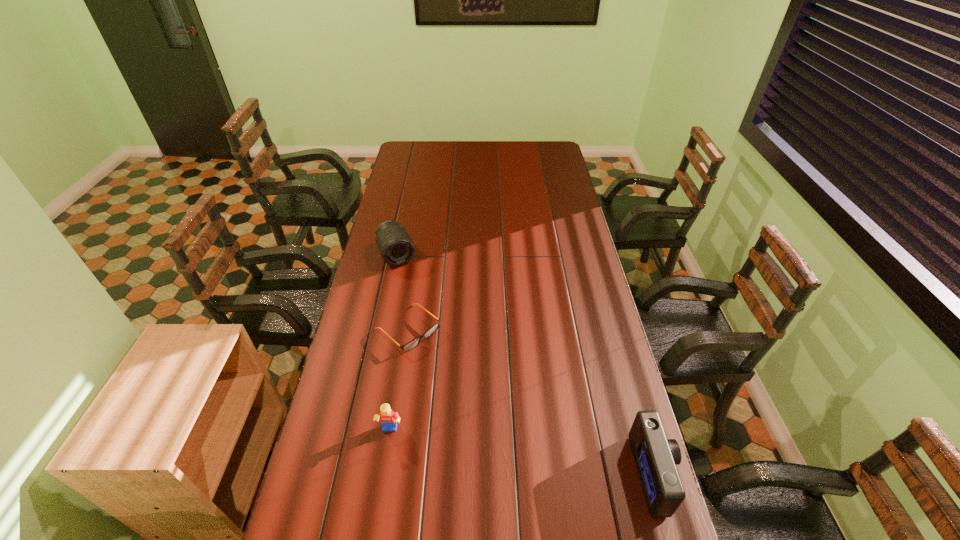
Image resolution: width=960 pixels, height=540 pixels. I want to click on the closest object to the telephoto lens, so click(413, 343).

Identify the location of the closest object to the rightmost object. tap(413, 343).

The width and height of the screenshot is (960, 540). In order to click on blank area in the image that satisfies the following two spatial constraints: 1. on the front side of the third nearest object; 2. on the front-facing side of the rightmost object in this screenshot , I will do `click(385, 475)`.

Locate an element on the screen. The height and width of the screenshot is (540, 960). free spot that satisfies the following two spatial constraints: 1. on the face of the Lego; 2. on the front-facing side of the camera is located at coordinates (383, 475).

Where is `free space that satisfies the following two spatial constraints: 1. on the face of the second shortest object; 2. on the front-facing side of the rightmost object`? This screenshot has width=960, height=540. free space that satisfies the following two spatial constraints: 1. on the face of the second shortest object; 2. on the front-facing side of the rightmost object is located at coordinates (383, 475).

The width and height of the screenshot is (960, 540). Identify the location of blank area in the image that satisfies the following two spatial constraints: 1. on the face of the rightmost object; 2. on the front-facing side of the Lego. (383, 475).